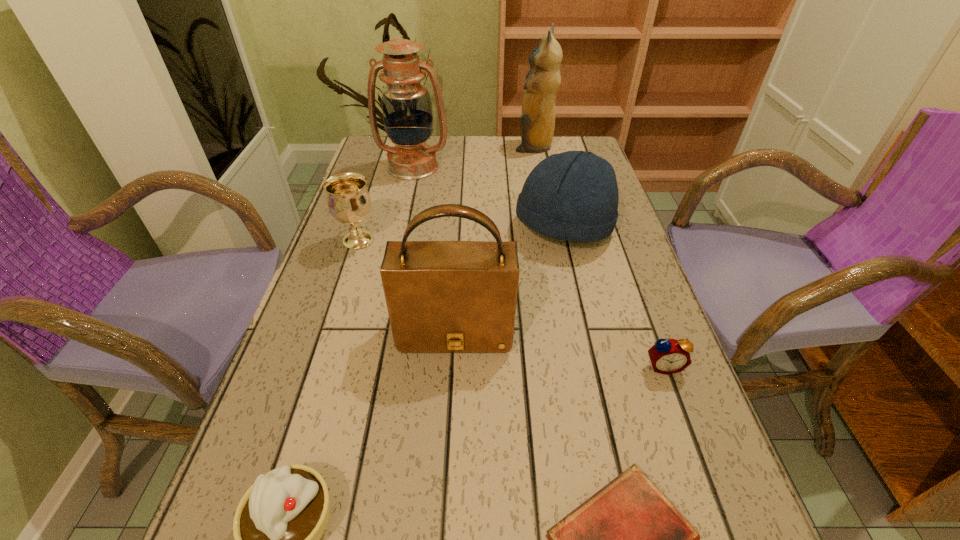
This screenshot has height=540, width=960. Find the location of `vacant point located 0.300m on the front of the second farthest object`. vacant point located 0.300m on the front of the second farthest object is located at coordinates (396, 244).

The height and width of the screenshot is (540, 960). I want to click on vacant area situated 0.220m on the front flap of the third tallest object, so [x=447, y=474].

Locate an element on the screen. blank area located on the front of the skullcap is located at coordinates (586, 320).

Where is `vacant space located 0.340m on the right of the chalice`? This screenshot has height=540, width=960. vacant space located 0.340m on the right of the chalice is located at coordinates (516, 240).

What are the coordinates of `vacant space located on the front-facing side of the third nearest object` in the screenshot? It's located at (683, 421).

This screenshot has height=540, width=960. In order to click on cat located in the far edge section of the desktop in this screenshot , I will do `click(543, 80)`.

Locate an element on the screen. oil lamp situated at the far edge is located at coordinates (407, 112).

This screenshot has height=540, width=960. Identify the location of oil lamp located in the left edge section of the desktop. (407, 112).

The image size is (960, 540). I want to click on chalice positioned at the left edge, so click(349, 202).

Locate an element on the screen. This screenshot has height=540, width=960. cat that is positioned at the right edge is located at coordinates (543, 80).